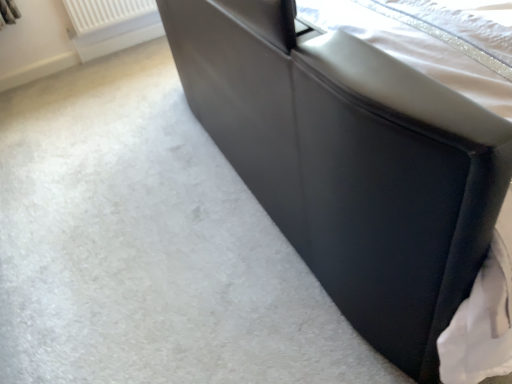
The height and width of the screenshot is (384, 512). What do you see at coordinates (350, 164) in the screenshot?
I see `matte black bed at center` at bounding box center [350, 164].

At what (x,y) coordinates should I click in order to perform the action: click on matte black bed at center. Please return your answer as a coordinate pair (x, y). Looking at the image, I should click on (350, 164).

The width and height of the screenshot is (512, 384). I want to click on matte black bed at center, so click(x=350, y=164).